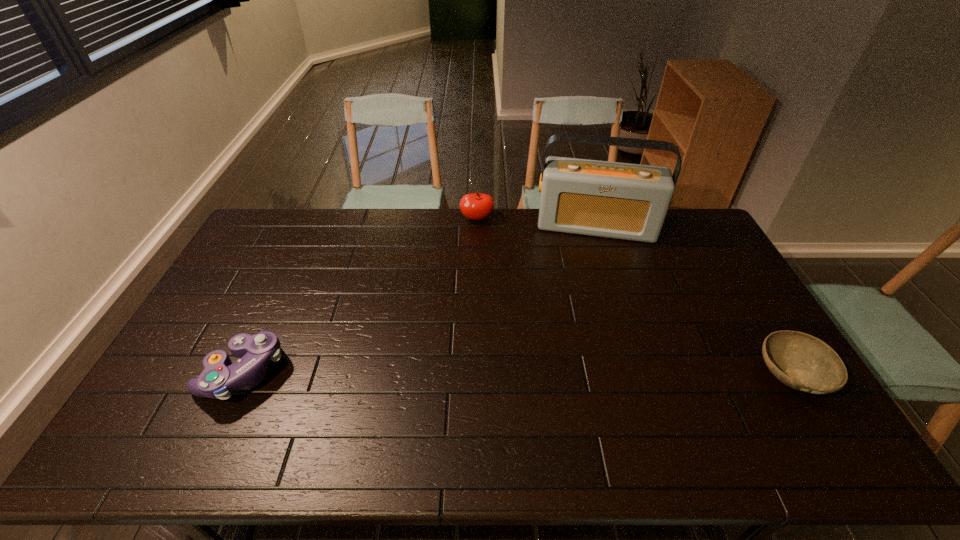
At what (x,y) coordinates should I click in order to perform the action: click on free space that satisfies the following two spatial constraints: 1. on the front side of the control; 2. on the right side of the shortest object. Please return your answer as a coordinate pair (x, y). This screenshot has width=960, height=540. Looking at the image, I should click on (241, 375).

The height and width of the screenshot is (540, 960). I want to click on vacant region that satisfies the following two spatial constraints: 1. on the back side of the tallest object; 2. on the right side of the second shortest object, so click(311, 227).

I want to click on free location that satisfies the following two spatial constraints: 1. on the front side of the rightmost object; 2. on the right side of the tallest object, so click(x=644, y=375).

Find the location of a particular element. free space that satisfies the following two spatial constraints: 1. on the front side of the tallest object; 2. on the right side of the second tallest object is located at coordinates (477, 227).